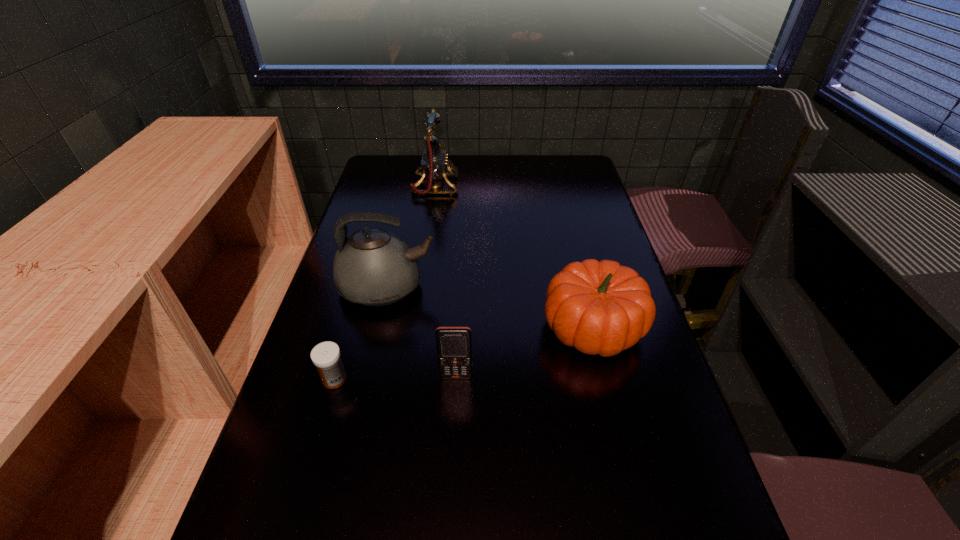
This screenshot has width=960, height=540. Identify the location of unoccupied area between the kettle and the cellular telephone. (422, 332).

Image resolution: width=960 pixels, height=540 pixels. In order to click on free space between the telephone and the cellular telephone in this screenshot , I will do `click(445, 281)`.

The width and height of the screenshot is (960, 540). I want to click on empty space between the kettle and the farthest object, so click(412, 237).

The height and width of the screenshot is (540, 960). Find the location of `vacant area that lies between the rightmost object and the farthest object`. vacant area that lies between the rightmost object and the farthest object is located at coordinates (514, 257).

Image resolution: width=960 pixels, height=540 pixels. In order to click on unoccupied position between the rightmost object and the farthest object in this screenshot , I will do `click(514, 257)`.

Select which object appears as the closest to the medicine. Please provide its 2D coordinates. Your answer should be formatted as a tuple, i.e. [(x, y)], where the tuple contains the x and y coordinates of a point satisfying the conditions above.

[(373, 267)]

Select which object appears as the fourth closest to the rightmost object. Please provide its 2D coordinates. Your answer should be formatted as a tuple, i.e. [(x, y)], where the tuple contains the x and y coordinates of a point satisfying the conditions above.

[(434, 161)]

Where is `vacant space that satisfies the following two spatial constraints: 1. on the back side of the rightmost object; 2. on the front of the telephone, featuring the rotary dial`? vacant space that satisfies the following two spatial constraints: 1. on the back side of the rightmost object; 2. on the front of the telephone, featuring the rotary dial is located at coordinates (557, 186).

Identify the location of vacant position in the image that satisfies the following two spatial constraints: 1. on the front of the farthest object, featuring the rotary dial; 2. on the left side of the rightmost object. (415, 327).

What are the coordinates of `blank space that satisfies the following two spatial constraints: 1. on the front of the telephone, featuring the rotary dial; 2. on the right side of the rightmost object` in the screenshot? It's located at pos(415,327).